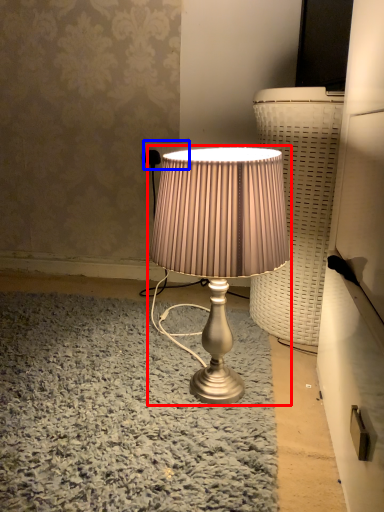
Question: Which object appears farthest to the camera in this image, lamp (highlighted by a red box) or electric outlet (highlighted by a blue box)?

Choices:
 (A) lamp
 (B) electric outlet

Answer: (B)